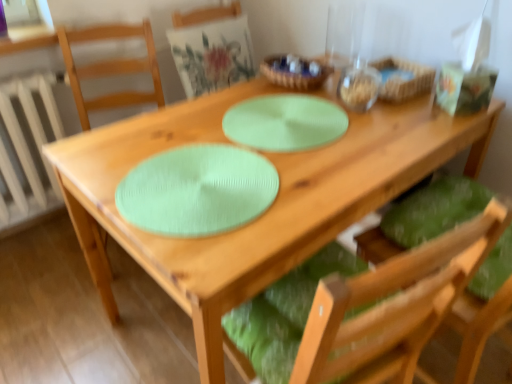
Locate an element on the screen. free spot below green textured placemat at center (from a real-world perspective) is located at coordinates (288, 120).